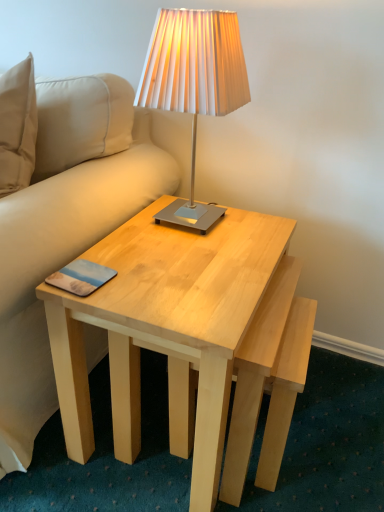
This screenshot has height=512, width=384. Find the location of `free space to the right of light wood coffee table at center`. free space to the right of light wood coffee table at center is located at coordinates (339, 425).